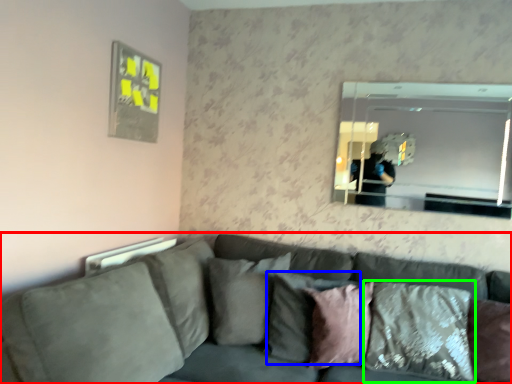
Question: Considering the real-world distances, which object is closest to studio couch (highlighted by a red box)? pillow (highlighted by a blue box) or pillow (highlighted by a green box).

Choices:
 (A) pillow
 (B) pillow

Answer: (A)